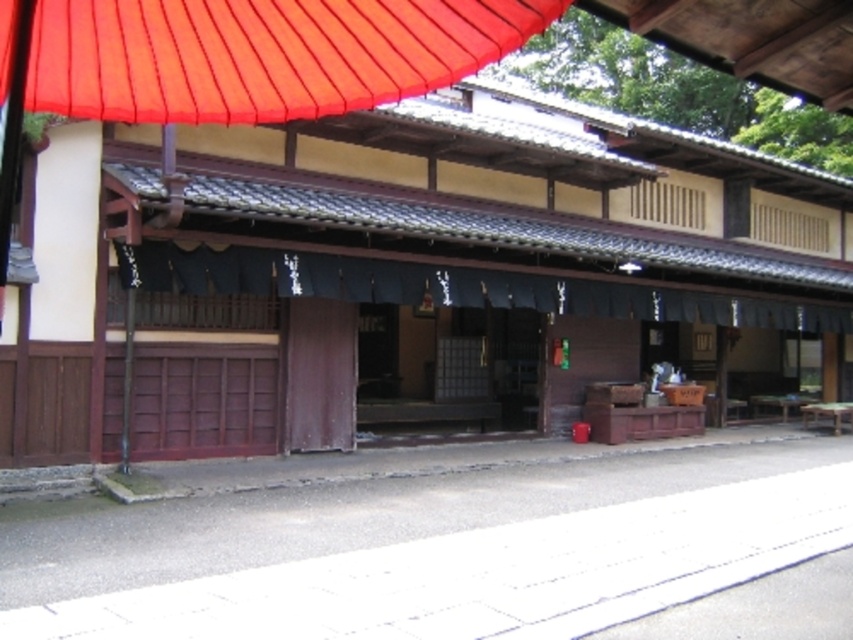
Is point (837, 198) farther from camera compared to point (595, 296)?

Yes.

At what (x,y) coordinates should I click in order to perform the action: click on brown wooden hut at center. Please return your answer as a coordinate pair (x, y). This screenshot has width=853, height=640. Looking at the image, I should click on (386, 259).